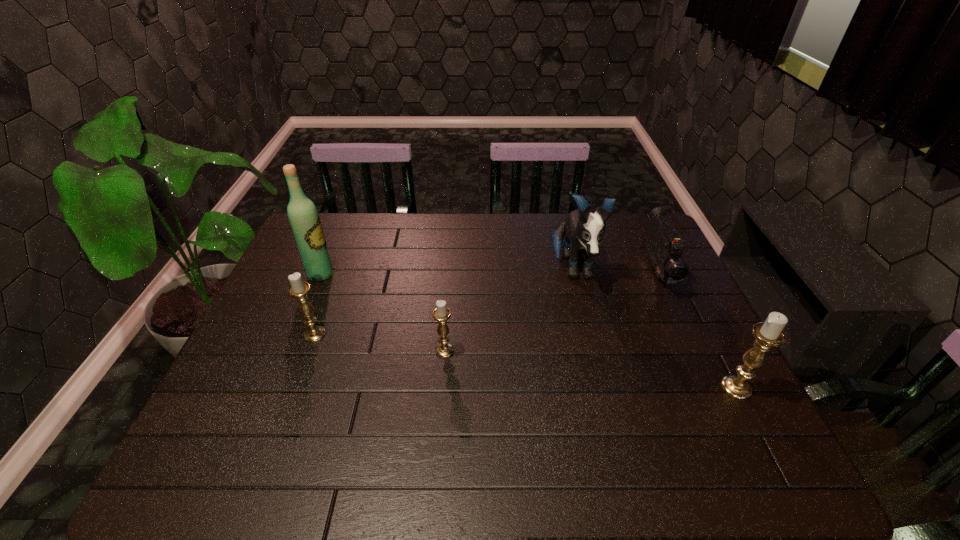
To make them evenly spaced by inserting another candle_holder among them, please locate a free space for this new candle_holder. Please provide its 2D coordinates. Your answer should be formatted as a tuple, i.e. [(x, y)], where the tuple contains the x and y coordinates of a point satisfying the conditions above.

[(585, 368)]